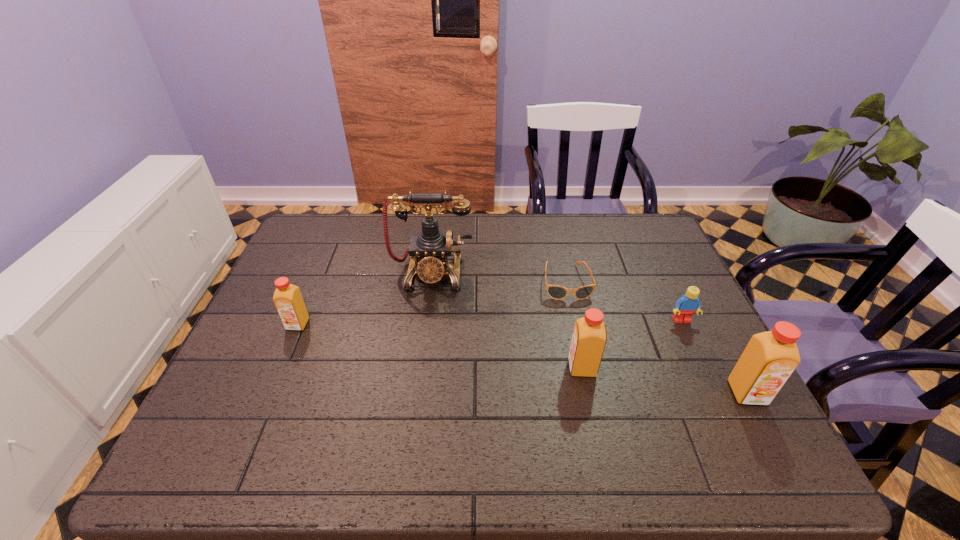
Locate an element on the screen. orange juice located at the right edge is located at coordinates (769, 359).

Image resolution: width=960 pixels, height=540 pixels. I want to click on Lego situated at the right edge, so (689, 303).

Find the location of a particular element. object at the near right corner is located at coordinates (769, 359).

Where is `vacant space at the far edge of the desktop`? vacant space at the far edge of the desktop is located at coordinates [x=519, y=246].

Identify the location of free space at the near edge of the desktop. (488, 424).

Image resolution: width=960 pixels, height=540 pixels. In the image, there is a desktop. What are the coordinates of `free space at the left edge` in the screenshot? It's located at (293, 381).

You are a GUI agent. You are given a task and a screenshot of the screen. Output one action in this format:
    pyautogui.click(x=<x>, y=<y>)
    Task: Click on the vacant space at the right edge of the desktop
    This screenshot has width=960, height=540.
    Given the screenshot: What is the action you would take?
    pyautogui.click(x=643, y=276)

In the image, there is a desktop. Where is `vacant space at the far left corner`? Image resolution: width=960 pixels, height=540 pixels. vacant space at the far left corner is located at coordinates (343, 246).

This screenshot has height=540, width=960. What are the coordinates of `blank space at the far right corner of the desktop` in the screenshot? It's located at (641, 249).

At what (x,y) coordinates should I click in order to perform the action: click on vacant area that lies between the fifth object from right to left and the sunglasses. Please return your answer as a coordinate pair (x, y). This screenshot has height=540, width=960. Looking at the image, I should click on (498, 278).